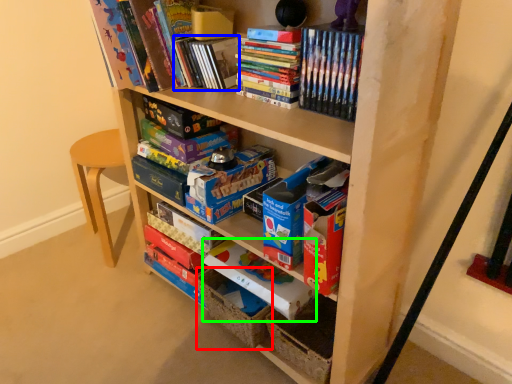
Question: Considering the real-world distances, which object is closest to storage box (highlighted by a red box)? paperback book (highlighted by a blue box) or paperback book (highlighted by a green box).

Choices:
 (A) paperback book
 (B) paperback book

Answer: (B)